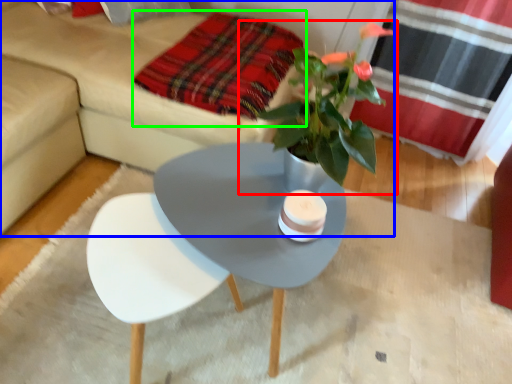
Question: Based on their relative distances, which object is farther from houseplant (highlighted by a red box)? Choose from studio couch (highlighted by a blue box) and blanket (highlighted by a green box).

Choices:
 (A) studio couch
 (B) blanket

Answer: (A)